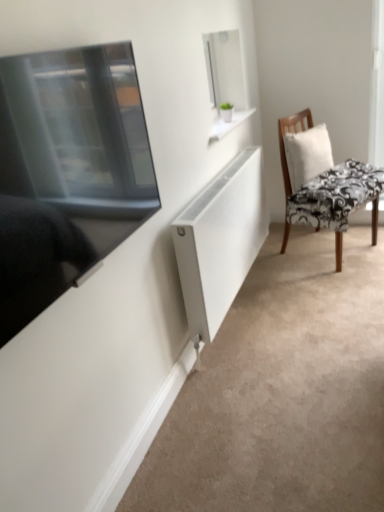
Question: Is point (292, 148) positioned closer to the camera than point (0, 186)?

Choices:
 (A) farther
 (B) closer

Answer: (A)

Question: Considering their positions, is white fabric pillow at right located in front of or behind matte black tv at left?

Choices:
 (A) front
 (B) behind

Answer: (B)

Question: Estimate the real-world distances between objects in this image. Which object is farther from the matte black tv at left?

Choices:
 (A) black floral fabric chair at right
 (B) white fabric pillow at right
 (C) white matte radiator at center

Answer: (B)

Question: Which object is positioned farthest from the white fabric pillow at right?

Choices:
 (A) white matte radiator at center
 (B) black floral fabric chair at right
 (C) matte black tv at left

Answer: (C)